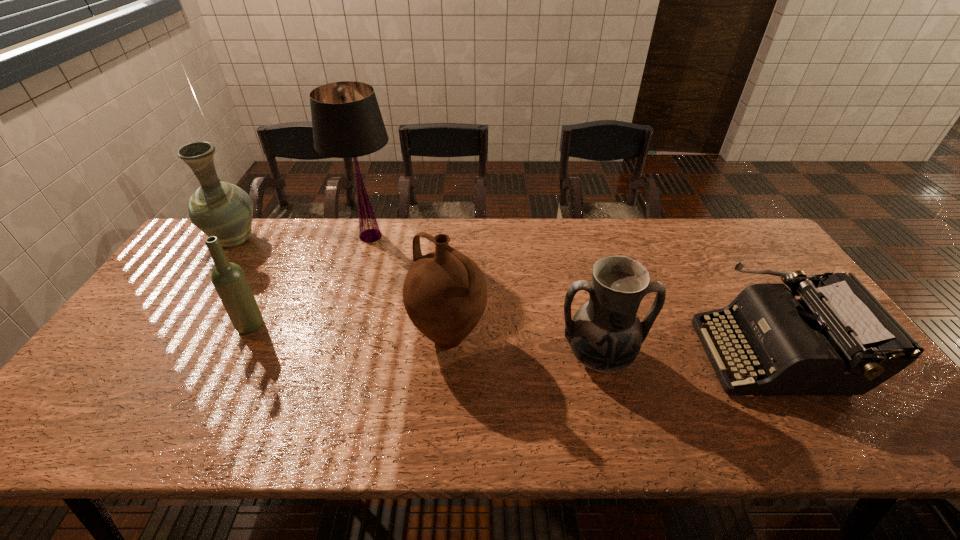
You are a GUI agent. You are given a task and a screenshot of the screen. Output one action in this format:
    pyautogui.click(x=<x>, y=<y>)
    Task: Click on the vacant space in between the second object from right to left and the fifth object from right to left
    This screenshot has height=540, width=960.
    Given the screenshot: What is the action you would take?
    pyautogui.click(x=424, y=341)

At what (x,y) coordinates should I click in order to perform the action: click on vacant space that is in between the wine bottle and the second pitcher from left to right. Please return your answer as a coordinate pair (x, y). The height and width of the screenshot is (540, 960). Looking at the image, I should click on (349, 331).

Locate an element on the screen. Image resolution: width=960 pixels, height=540 pixels. vacant area that lies between the third object from left to right and the second object from left to right is located at coordinates (311, 281).

You are a GUI agent. You are given a task and a screenshot of the screen. Output one action in this format:
    pyautogui.click(x=<x>, y=<y>)
    Task: Click on the vacant region between the wine bottle and the fourth object from left to right
    The image size is (960, 540).
    Given the screenshot: What is the action you would take?
    pyautogui.click(x=349, y=331)

Where is `blank region between the shortest object and the rightmost pitcher`? blank region between the shortest object and the rightmost pitcher is located at coordinates (686, 355).

Image resolution: width=960 pixels, height=540 pixels. Identify the location of vacant area that lies between the second pitcher from left to right and the wine bottle. (349, 331).

This screenshot has width=960, height=540. Find the location of `unoccupied area between the farthest pitcher and the second pitcher from left to right`. unoccupied area between the farthest pitcher and the second pitcher from left to right is located at coordinates (342, 288).

Image resolution: width=960 pixels, height=540 pixels. What are the coordinates of `unoccupied position between the third object from left to right and the leftmost object` in the screenshot? It's located at 303,238.

Where is `the fifth closest object to the rightmost pitcher`? the fifth closest object to the rightmost pitcher is located at coordinates (217, 208).

Select which object appears as the second closest to the lampshade. Please provide its 2D coordinates. Your answer should be formatted as a tuple, i.e. [(x, y)], where the tuple contains the x and y coordinates of a point satisfying the conditions above.

[(445, 293)]